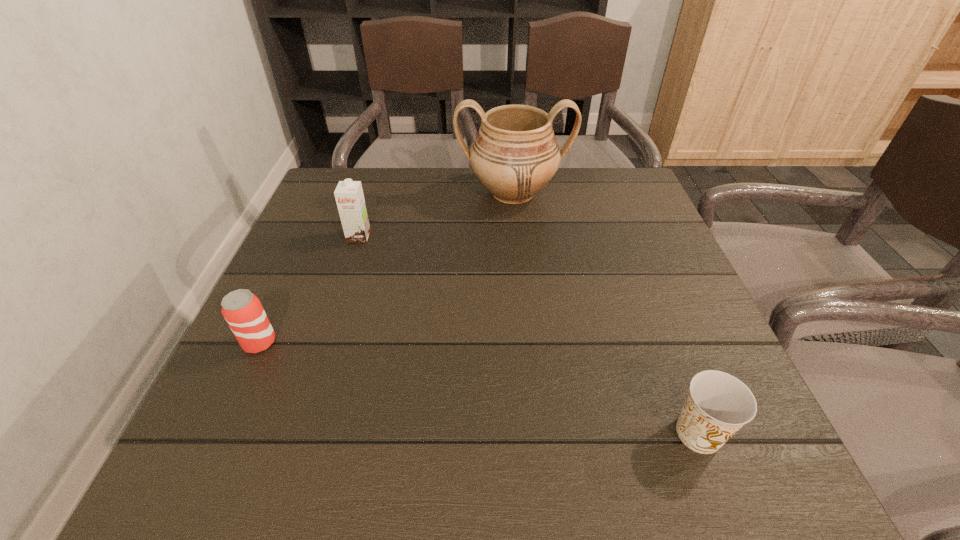
You are a GUI agent. You are given a task and a screenshot of the screen. Output one action in this format:
    pyautogui.click(x=<x>, y=<y>)
    Task: Click on the farthest object
    The image size is (960, 540).
    Given the screenshot: What is the action you would take?
    pyautogui.click(x=515, y=154)

At what (x,y) coordinates should I click in order to perform the action: click on the second object from right to left. Please return your answer as a coordinate pair (x, y). Looking at the image, I should click on (515, 154).

Where is `the third object from right to left`? This screenshot has height=540, width=960. the third object from right to left is located at coordinates (349, 196).

What are the coordinates of `chocolate milk` in the screenshot? It's located at (349, 196).

I want to click on beer can, so click(242, 310).

Where is `the third farthest object`? The height and width of the screenshot is (540, 960). the third farthest object is located at coordinates (x=242, y=310).

Where is `Dixie cup`? This screenshot has width=960, height=540. Dixie cup is located at coordinates (718, 404).

This screenshot has height=540, width=960. Identify the location of the nearest object. (718, 404).

Identify the location of blank space located 0.190m on the front-facing side of the tallest object. (520, 270).

Where is `vacant space located on the front of the second farthest object`? This screenshot has height=540, width=960. vacant space located on the front of the second farthest object is located at coordinates (336, 307).